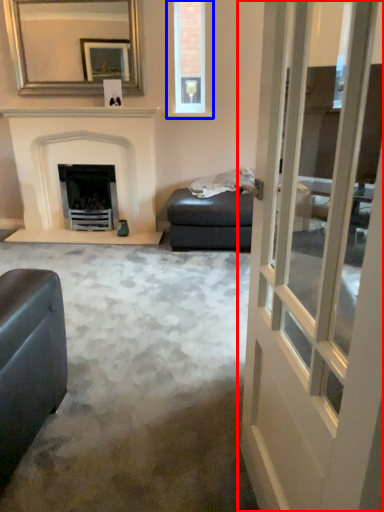
Question: Which object is closer to the camera taking this photo, door (highlighted by a red box) or window (highlighted by a blue box)?

Choices:
 (A) door
 (B) window

Answer: (A)